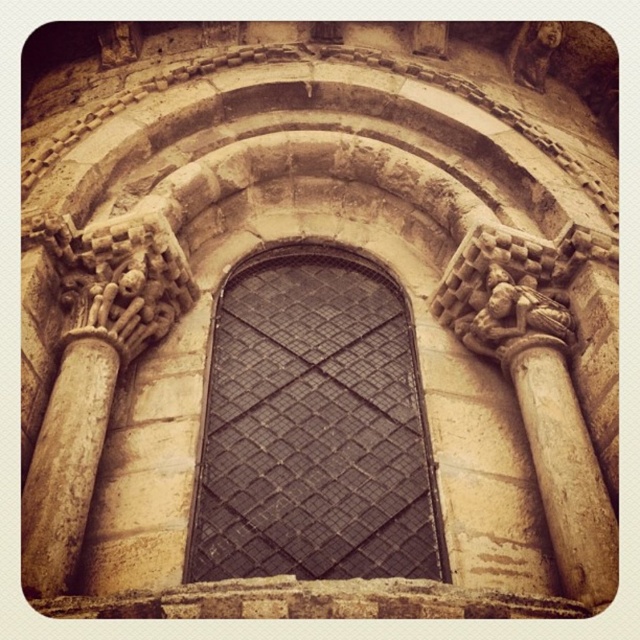
From the picture: You are an architect reviewing the design of a historical building. You notice the black metal grid at center and the beige stone column at right. Based on their positions, which one is located higher up in the image?

The black metal grid at center is above the beige stone column at right, so it is located higher up in the image.

You are an interior designer planning to install a decorative element between the black metal grid at center and the beige stone column at right. To ensure proper spacing, which object is wider so you can center the element appropriately?

The black metal grid at center is wider than the beige stone column at right, so you should center the decorative element between them based on the width of the black metal grid at center.

You are a painter standing at the base of the arched window. You need to paint the black metal grid at center and the beige stone column at right. Given that your ladder can reach up to 12 meters, will you be able to reach both objects with your current ladder?

The black metal grid at center is 13.23 meters away from beige stone column at right. Since the distance between them is greater than the ladder height of 12 meters, the painter cannot reach both objects with the current ladder.